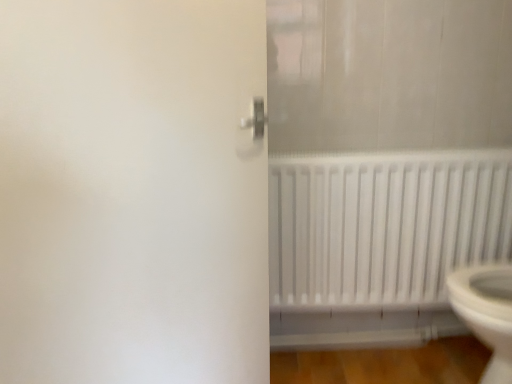
Question: From a real-world perspective, is white matte radiator at lower right below white matte door at left?

Choices:
 (A) yes
 (B) no

Answer: (A)

Question: Is there a large distance between white matte radiator at lower right and white matte door at left?

Choices:
 (A) yes
 (B) no

Answer: (B)

Question: Would you say white matte radiator at lower right is outside white matte door at left?

Choices:
 (A) no
 (B) yes

Answer: (B)

Question: Considering the relative sizes of white matte radiator at lower right and white matte door at left in the image provided, is white matte radiator at lower right taller than white matte door at left?

Choices:
 (A) yes
 (B) no

Answer: (B)

Question: Is white matte radiator at lower right surrounding white matte door at left?

Choices:
 (A) no
 (B) yes

Answer: (A)

Question: Can you confirm if white matte radiator at lower right is positioned to the right of white matte door at left?

Choices:
 (A) yes
 (B) no

Answer: (A)

Question: From a real-world perspective, does white matte door at left sit lower than white matte radiator at lower right?

Choices:
 (A) yes
 (B) no

Answer: (B)

Question: Is white matte door at left taller than white matte radiator at lower right?

Choices:
 (A) no
 (B) yes

Answer: (B)

Question: From the image's perspective, is white matte door at left on top of white matte radiator at lower right?

Choices:
 (A) yes
 (B) no

Answer: (A)

Question: Is white matte door at left oriented away from white matte radiator at lower right?

Choices:
 (A) yes
 (B) no

Answer: (B)

Question: Does white matte door at left lie behind white matte radiator at lower right?

Choices:
 (A) yes
 (B) no

Answer: (B)

Question: Is white matte door at left at the left side of white matte radiator at lower right?

Choices:
 (A) no
 (B) yes

Answer: (B)

Question: Considering the positions of white matte radiator at lower right and white matte door at left in the image, is white matte radiator at lower right wider or thinner than white matte door at left?

Choices:
 (A) wide
 (B) thin

Answer: (A)